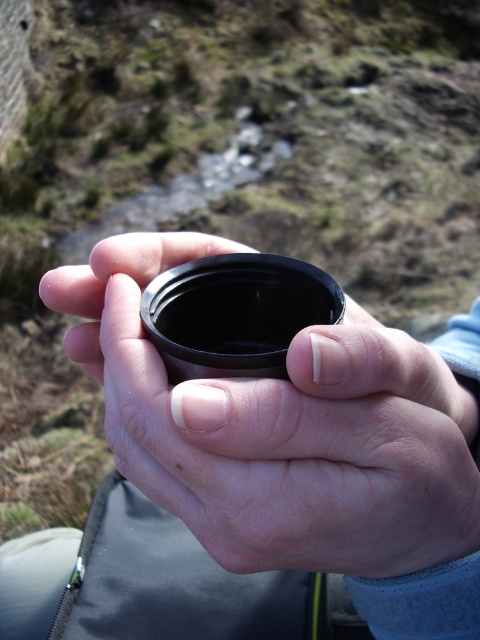
In the scene shown: You are a photographer trying to focus on the black cylindrical object in the center of the image. There is a point at coordinates point (280, 429) that you need to check. Is this point located on the black cylindrical object?

Yes, the point (280, 429) is on the black matte cup at center, so it is located on the black cylindrical object.

Looking at this image, you are a photographer carrying a black matte cup at center and a black matte lens at center. You want to take a photo of the stream in the background. Which object should you move first to ensure the stream is in focus?

You should move the black matte cup at center first because it is closer to the viewer than the black matte lens at center, so adjusting its position will have a more immediate effect on the stream being in focus.

Consider the image. Based on the scene description, where is the black matte cup at center located in terms of its 2D coordinates?

The black matte cup at center is located at the 2D coordinates point [280,429].